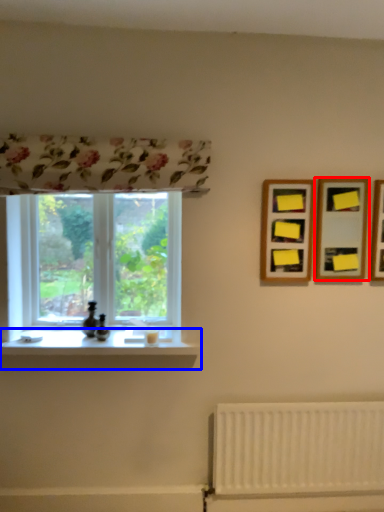
Question: Which object is closer to the camera taking this photo, picture frame (highlighted by a red box) or window sill (highlighted by a blue box)?

Choices:
 (A) picture frame
 (B) window sill

Answer: (B)